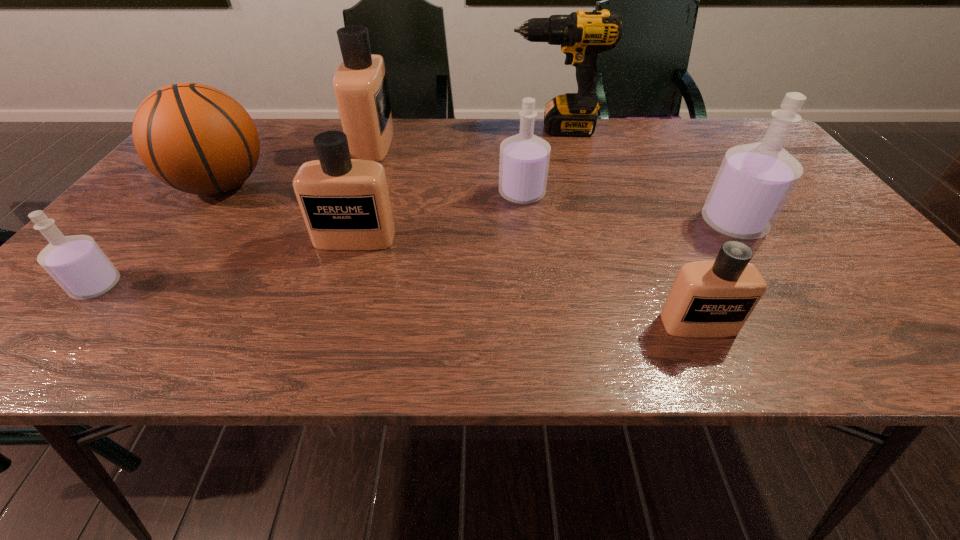
The width and height of the screenshot is (960, 540). Find the location of `vacant space at the near edge`. vacant space at the near edge is located at coordinates (355, 357).

Locate an element on the screen. The width and height of the screenshot is (960, 540). free space at the left edge of the desktop is located at coordinates (126, 235).

I want to click on vacant area at the right edge, so click(849, 253).

Locate an element on the screen. This screenshot has width=960, height=540. vacant point located between the basketball and the drill is located at coordinates (388, 157).

I want to click on vacant space that is in between the fourth perfume from left to right and the second biggest beige perfume, so click(x=439, y=216).

This screenshot has height=540, width=960. I want to click on free space between the basketball and the farthest perfume, so click(x=297, y=164).

Where is `vacant space that's between the nearest purple perfume and the farthest beige perfume`? vacant space that's between the nearest purple perfume and the farthest beige perfume is located at coordinates (235, 215).

Where is `free space between the nearest beige perfume and the second purple perfume from left to right`? free space between the nearest beige perfume and the second purple perfume from left to right is located at coordinates (611, 259).

The height and width of the screenshot is (540, 960). I want to click on empty space between the drill and the rightmost purple perfume, so click(x=644, y=177).

Find the location of `free spot between the farthest perfume and the nearest purple perfume`. free spot between the farthest perfume and the nearest purple perfume is located at coordinates (235, 215).